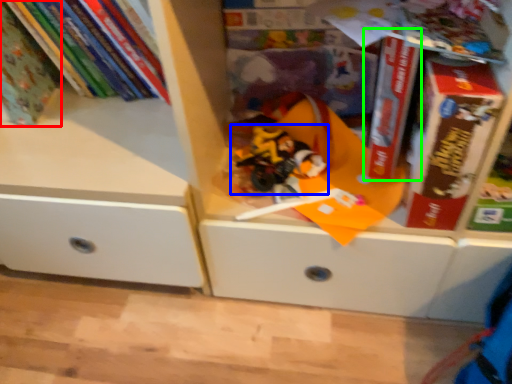
Question: Considering the real-world distances, which object is farthest from book (highlighted by a red box)? toy (highlighted by a blue box) or paperback book (highlighted by a green box)?

Choices:
 (A) toy
 (B) paperback book

Answer: (B)